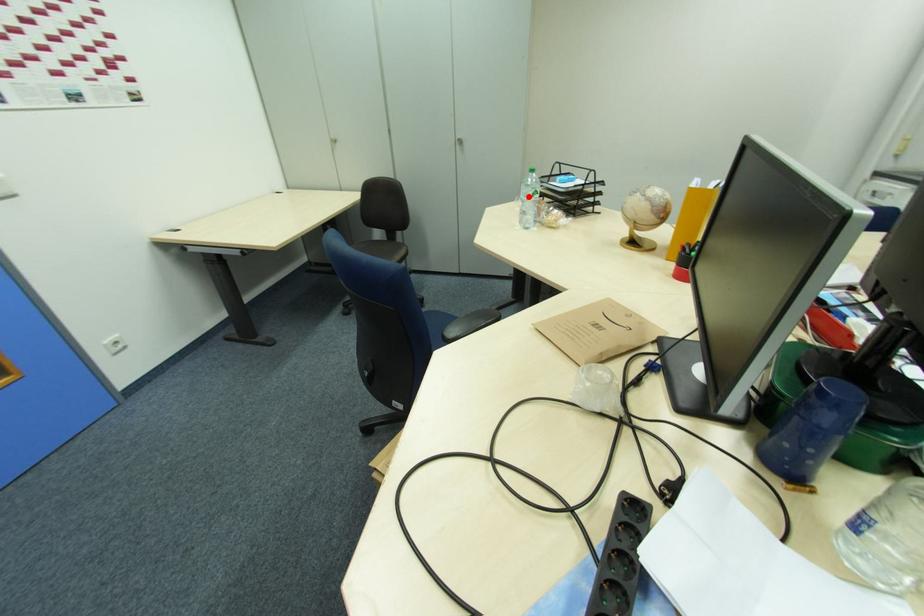
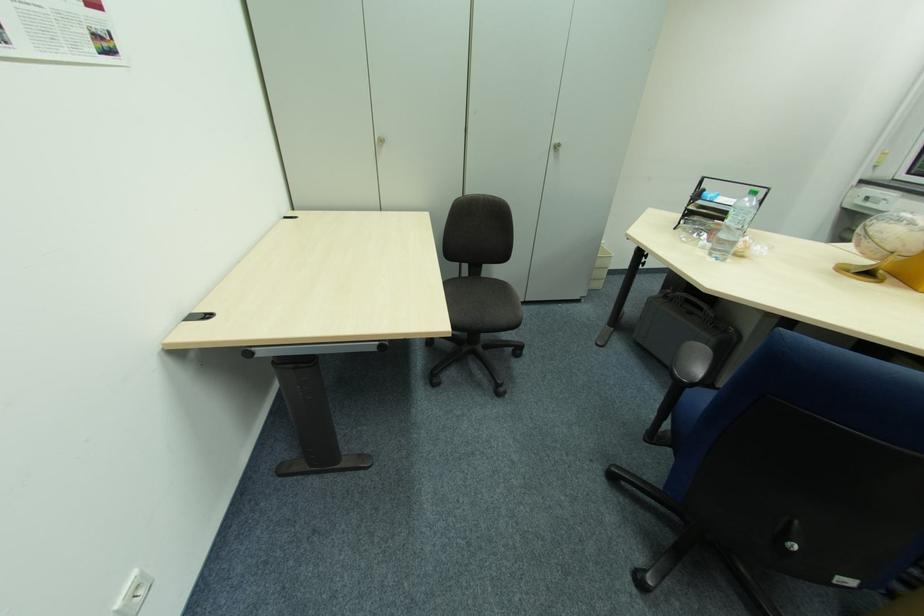
Find the pixel in the second image that matches the highlighted location in the first image.

(743, 224)